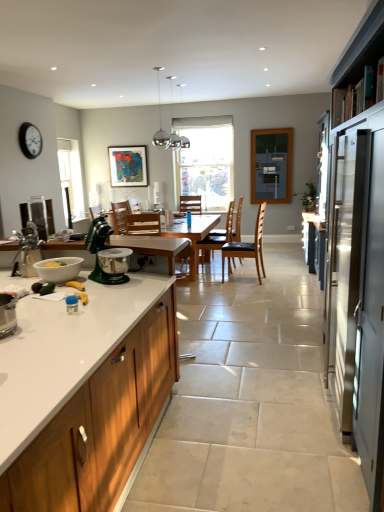
This screenshot has width=384, height=512. What are the coordinates of `free region on the left part of satin silver mixer at left, placed as the third appliance when sorted from right to left` in the screenshot? It's located at pos(17,244).